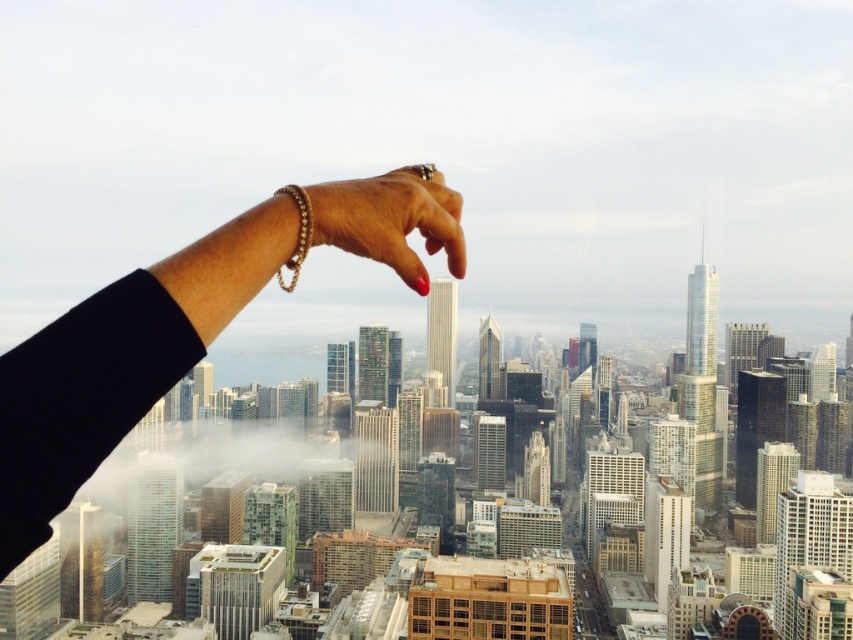
You are an artist trying to paint the scene. You notice two gold bracelets on the hand in the image. Which bracelet is closer to you, the gold chain bracelet at upper center or the gold metallic bracelet at upper center?

The gold chain bracelet at upper center is closer to you because it is further to the viewer than the gold metallic bracelet at upper center.

You are an architect designing a new building and want to place a model of the city on your desk. If you place a small flag at both point [444,196] and point [381,259], which flag will appear closer to you when viewed from above?

Point [381,259] will appear closer to you because it is in front of point [444,196] according to their positions.